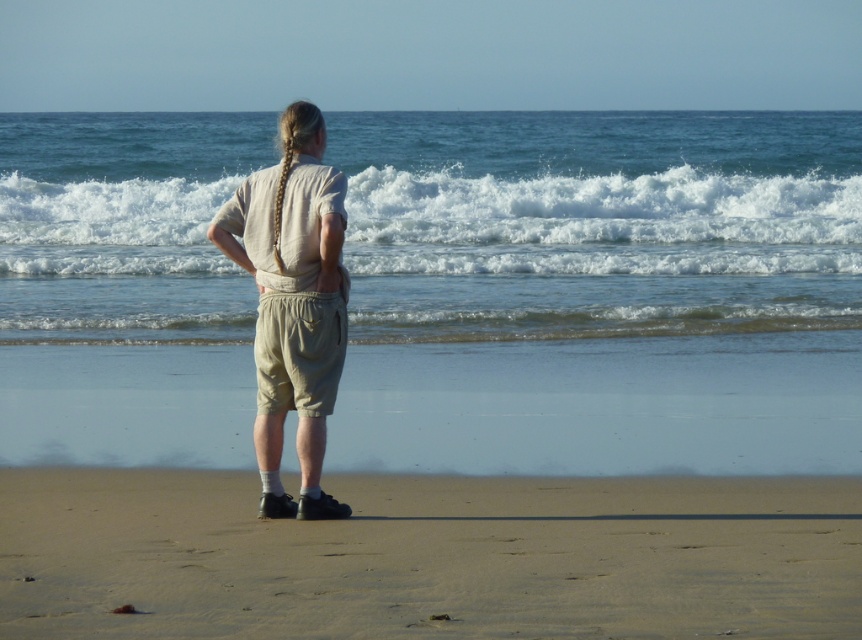
You are a fashion designer analyzing the outfit of the person in the image. Which item, the sandy beige at lower center or the beige cotton shorts at center, has a larger width measurement?

The sandy beige at lower center might be wider than beige cotton shorts at center according to the description.

You are a photographer trying to capture the white frothy wave at upper center. Based on the scene, where should you position yourself to ensure the wave is in the center of your photo?

Position yourself so that the white frothy wave at upper center is centered at coordinates approximately 0.350 on the x axis and 0.698 on the y axis.

You are a photographer trying to capture the scene of a person on the beach. You want to ensure the sandy beige at lower center and the white frothy wave at upper center are both visible in your shot. Based on their positions, can you confirm if the wave is above the sand in the image?

Yes, the white frothy wave at upper center is above the sandy beige at lower center in the image.